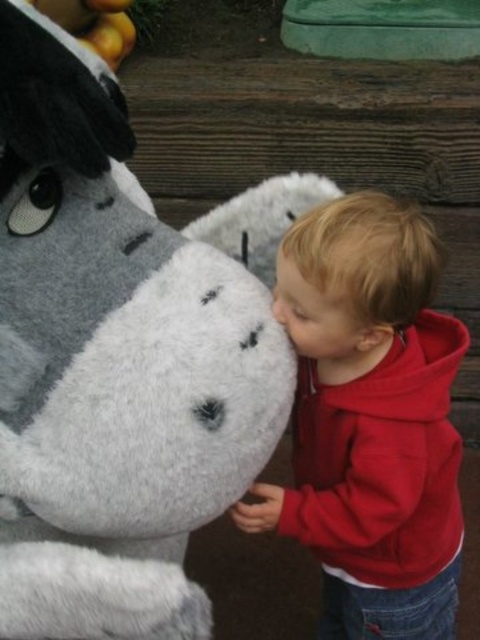
Is fluffy gray plush at left above fuzzy gray nose at lower center?

Correct, fluffy gray plush at left is located above fuzzy gray nose at lower center.

Does fluffy gray plush at left have a lesser width compared to fuzzy gray nose at lower center?

No.

Which is in front, point (131, 422) or point (289, 310)?

Point (131, 422)

This screenshot has height=640, width=480. I want to click on fluffy gray plush at left, so click(x=111, y=364).

Is fluffy gray plush at left above red fleece hoodie at lower right?

Indeed, fluffy gray plush at left is positioned over red fleece hoodie at lower right.

How distant is fluffy gray plush at left from red fleece hoodie at lower right?

They are 10.57 inches apart.

Describe the element at coordinates (111, 364) in the screenshot. The width and height of the screenshot is (480, 640). I see `fluffy gray plush at left` at that location.

This screenshot has height=640, width=480. Identify the location of fluffy gray plush at left. (x=111, y=364).

Measure the distance between red fleece hoodie at lower right and camera.

A distance of 83.17 centimeters exists between red fleece hoodie at lower right and camera.

Does red fleece hoodie at lower right have a lesser width compared to fuzzy gray nose at lower center?

No, red fleece hoodie at lower right is not thinner than fuzzy gray nose at lower center.

The width and height of the screenshot is (480, 640). Describe the element at coordinates (371, 420) in the screenshot. I see `red fleece hoodie at lower right` at that location.

Identify the location of red fleece hoodie at lower right. The image size is (480, 640). (371, 420).